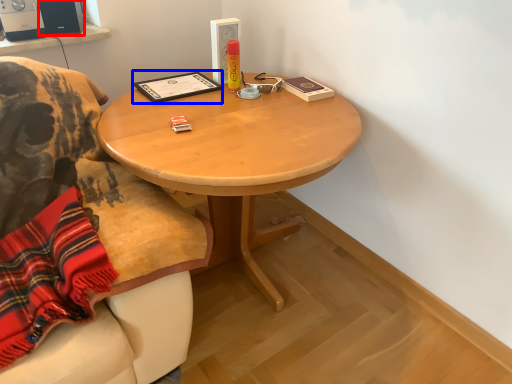
Question: Which object is closer to the camera taking this photo, loudspeaker (highlighted by a red box) or book (highlighted by a blue box)?

Choices:
 (A) loudspeaker
 (B) book

Answer: (B)